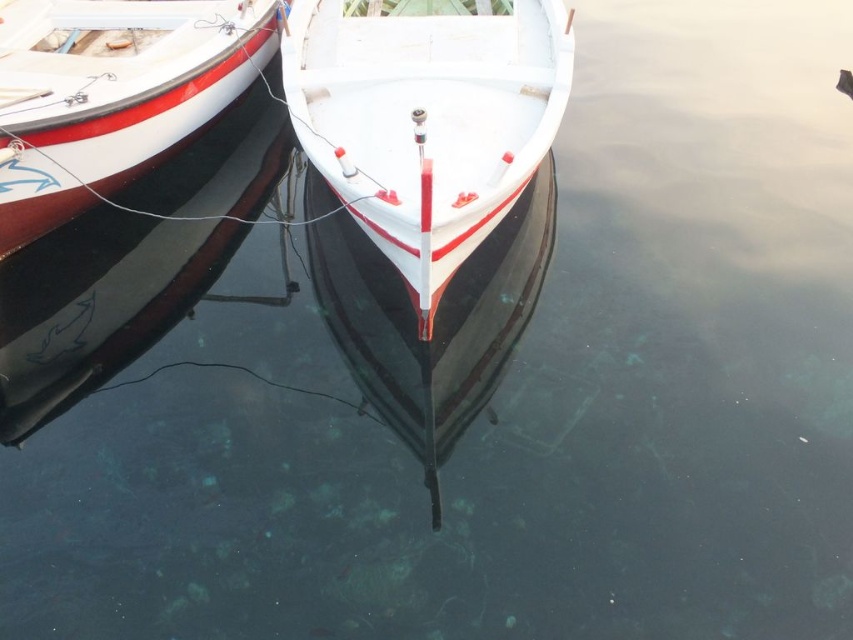
Which is in front, point (291, 118) or point (247, 83)?

Point (291, 118) is in front.

Which is more to the right, white matte boat at center or white glossy boat at center?

Positioned to the right is white matte boat at center.

Does point (293, 125) lie behind point (132, 129)?

No, it is in front of (132, 129).

This screenshot has height=640, width=853. Identify the location of white matte boat at center. (426, 118).